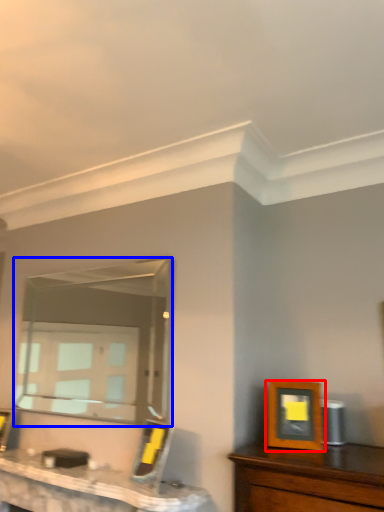
Question: Among these objects, which one is nearest to the camera, picture frame (highlighted by a red box) or mirror (highlighted by a blue box)?

Choices:
 (A) picture frame
 (B) mirror

Answer: (A)